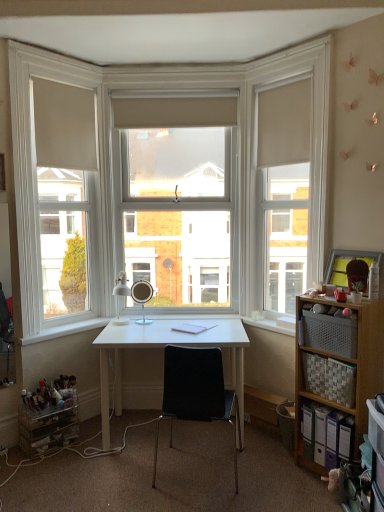
Question: Can you confirm if matte white table lamp at center, positioned as the 1th table lamp in left-to-right order, is thinner than white matte window frame at left, the first window frame from the left?

Choices:
 (A) no
 (B) yes

Answer: (A)

Question: Can you confirm if matte white table lamp at center, positioned as the 1th table lamp in left-to-right order, is positioned to the left of white matte window frame at left, the first window frame from the left?

Choices:
 (A) no
 (B) yes

Answer: (A)

Question: Does matte white table lamp at center, positioned as the 1th table lamp in left-to-right order, have a smaller size compared to white matte window frame at left, marked as the 2th window frame in a right-to-left arrangement?

Choices:
 (A) no
 (B) yes

Answer: (B)

Question: From the image's perspective, would you say matte white table lamp at center, arranged as the 2th table lamp when viewed from the right, is shown under white matte window frame at left, the first window frame from the left?

Choices:
 (A) yes
 (B) no

Answer: (A)

Question: From a real-world perspective, is matte white table lamp at center, positioned as the 1th table lamp in left-to-right order, physically above white matte window frame at left, marked as the 2th window frame in a right-to-left arrangement?

Choices:
 (A) no
 (B) yes

Answer: (A)

Question: From a real-world perspective, is matte white table lamp at center, positioned as the 1th table lamp in left-to-right order, under white matte window frame at left, marked as the 2th window frame in a right-to-left arrangement?

Choices:
 (A) no
 (B) yes

Answer: (B)

Question: From the image's perspective, is matte white table lamp at center, arranged as the 2th table lamp when viewed from the right, located above white wood frame at upper center, arranged as the second window frame when viewed from the left?

Choices:
 (A) no
 (B) yes

Answer: (A)

Question: Is matte white table lamp at center, positioned as the 1th table lamp in left-to-right order, not within white wood frame at upper center, marked as the first window frame in a right-to-left arrangement?

Choices:
 (A) no
 (B) yes

Answer: (B)

Question: Can you confirm if matte white table lamp at center, positioned as the 1th table lamp in left-to-right order, is bigger than white wood frame at upper center, arranged as the second window frame when viewed from the left?

Choices:
 (A) no
 (B) yes

Answer: (A)

Question: From a real-world perspective, does matte white table lamp at center, arranged as the 2th table lamp when viewed from the right, sit lower than white wood frame at upper center, marked as the first window frame in a right-to-left arrangement?

Choices:
 (A) yes
 (B) no

Answer: (A)

Question: Does matte white table lamp at center, arranged as the 2th table lamp when viewed from the right, appear on the left side of white wood frame at upper center, arranged as the second window frame when viewed from the left?

Choices:
 (A) no
 (B) yes

Answer: (B)

Question: From the image's perspective, does matte white table lamp at center, arranged as the 2th table lamp when viewed from the right, appear lower than white wood frame at upper center, arranged as the second window frame when viewed from the left?

Choices:
 (A) yes
 (B) no

Answer: (A)

Question: From the image's perspective, is satin silver mirror at center, the first table lamp positioned from the right, below matte white table lamp at center, arranged as the 2th table lamp when viewed from the right?

Choices:
 (A) no
 (B) yes

Answer: (B)